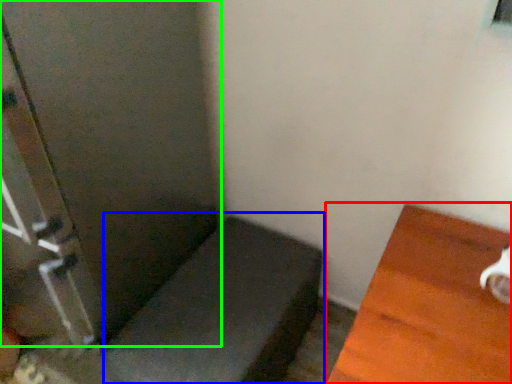
Question: Which object is the closest to the furniture (highlighted by a red box)? Choose among these: furniture (highlighted by a blue box) or screen door (highlighted by a green box).

Choices:
 (A) furniture
 (B) screen door

Answer: (A)